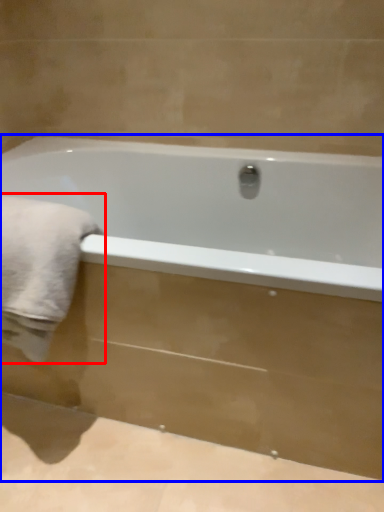
Question: Which of the following is the farthest to the observer, bath towel (highlighted by a red box) or bathtub (highlighted by a blue box)?

Choices:
 (A) bath towel
 (B) bathtub

Answer: (A)